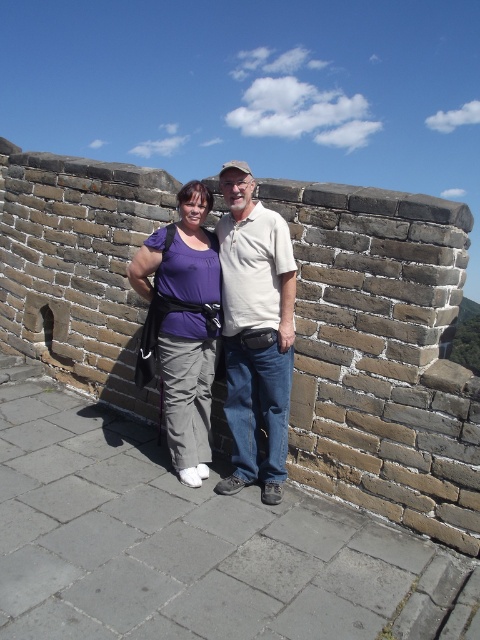
Question: Estimate the real-world distances between objects in this image. Which object is farther from the white cotton shirt at center?

Choices:
 (A) purple fabric pants at center
 (B) purple cotton shirt at center

Answer: (A)

Question: Can you confirm if purple cotton shirt at center is positioned above white cotton shirt at center?

Choices:
 (A) yes
 (B) no

Answer: (B)

Question: Which object appears closest to the camera in this image?

Choices:
 (A) white cotton shirt at center
 (B) purple fabric pants at center
 (C) purple cotton shirt at center

Answer: (A)

Question: Can you confirm if purple cotton shirt at center is wider than white cotton shirt at center?

Choices:
 (A) no
 (B) yes

Answer: (A)

Question: Does purple cotton shirt at center lie behind purple fabric pants at center?

Choices:
 (A) no
 (B) yes

Answer: (A)

Question: Which object is the closest to the purple fabric pants at center?

Choices:
 (A) white cotton shirt at center
 (B) purple cotton shirt at center

Answer: (A)